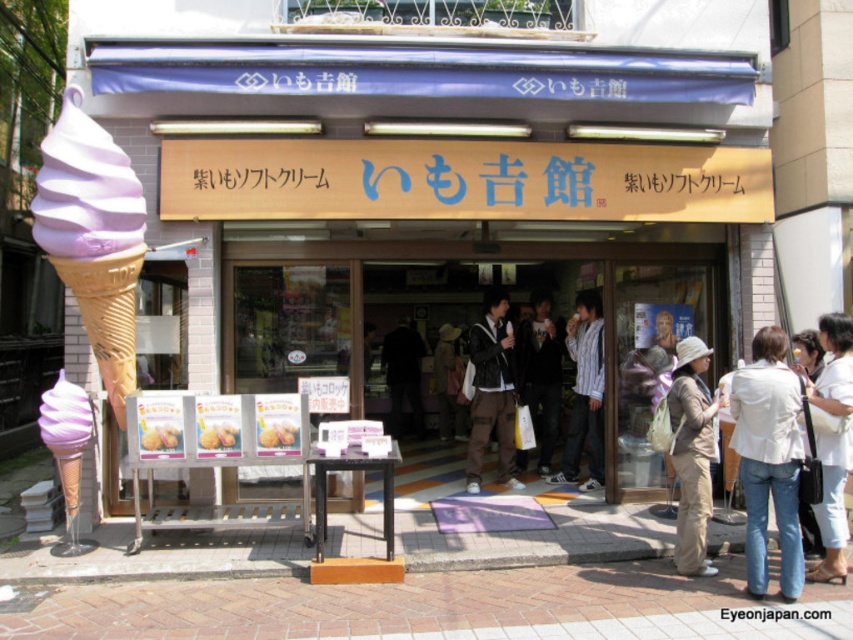
You are a customer standing outside the ice cream shop and want to point out both the striped cotton shirt at center and the matte purple ice cream cone at lower left to a friend. Which object is higher in the image?

The striped cotton shirt at center is located above the matte purple ice cream cone at lower left, so it is higher in the image.